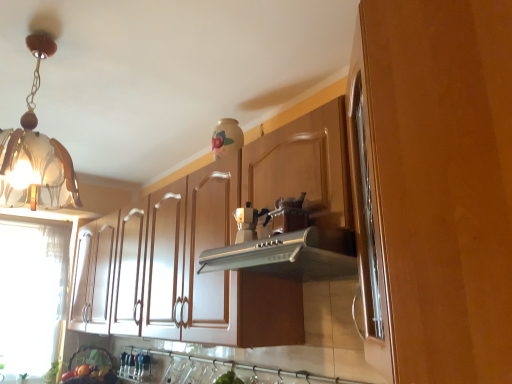
This screenshot has height=384, width=512. Find the location of `wooden cabinet at center, marked as the 1th cabinetry in a front-to-back arrangement`. wooden cabinet at center, marked as the 1th cabinetry in a front-to-back arrangement is located at coordinates (434, 187).

Is matte brown cabinet at center, which appears as the 2th cabinetry when viewed from the front, aimed at wooden cabinet at center, the second cabinetry viewed from the back?

No, matte brown cabinet at center, which appears as the 2th cabinetry when viewed from the front, is not facing towards wooden cabinet at center, the second cabinetry viewed from the back.

From a real-world perspective, does matte brown cabinet at center, which appears as the 2th cabinetry when viewed from the front, stand above wooden cabinet at center, marked as the 1th cabinetry in a front-to-back arrangement?

Correct, in the physical world, matte brown cabinet at center, which appears as the 2th cabinetry when viewed from the front, is higher than wooden cabinet at center, marked as the 1th cabinetry in a front-to-back arrangement.

Which object is positioned more to the left, matte brown cabinet at center, the first cabinetry in the back-to-front sequence, or wooden cabinet at center, the second cabinetry viewed from the back?

Positioned to the left is matte brown cabinet at center, the first cabinetry in the back-to-front sequence.

Considering the sizes of objects matte brown cabinet at center, which appears as the 2th cabinetry when viewed from the front, and wooden cabinet at center, marked as the 1th cabinetry in a front-to-back arrangement, in the image provided, who is thinner, matte brown cabinet at center, which appears as the 2th cabinetry when viewed from the front, or wooden cabinet at center, marked as the 1th cabinetry in a front-to-back arrangement,?

Thinner between the two is matte brown cabinet at center, which appears as the 2th cabinetry when viewed from the front.

Visually, is wooden cabinet at center, the second cabinetry viewed from the back, positioned to the left or to the right of translucent glass pendant light at upper left?

wooden cabinet at center, the second cabinetry viewed from the back, is positioned on translucent glass pendant light at upper left's right side.

How different are the orientations of wooden cabinet at center, the second cabinetry viewed from the back, and translucent glass pendant light at upper left in degrees?

There is a 89.5-degree angle between the facing directions of wooden cabinet at center, the second cabinetry viewed from the back, and translucent glass pendant light at upper left.

In the image, is wooden cabinet at center, the second cabinetry viewed from the back, positioned in front of or behind translucent glass pendant light at upper left?

Clearly, wooden cabinet at center, the second cabinetry viewed from the back, is in front of translucent glass pendant light at upper left.

From the image's perspective, who appears lower, wooden cabinet at center, the second cabinetry viewed from the back, or translucent glass pendant light at upper left?

From the image's view, wooden cabinet at center, the second cabinetry viewed from the back, is below.

Is matte brown cabinet at center, which appears as the 2th cabinetry when viewed from the front, positioned with its back to matte silver coffee machine at center?

Yes, matte brown cabinet at center, which appears as the 2th cabinetry when viewed from the front, is facing away from matte silver coffee machine at center.

From a real-world perspective, is matte brown cabinet at center, the first cabinetry in the back-to-front sequence, positioned under matte silver coffee machine at center based on gravity?

Yes, from a real-world perspective, matte brown cabinet at center, the first cabinetry in the back-to-front sequence, is under matte silver coffee machine at center.

Between matte brown cabinet at center, the first cabinetry in the back-to-front sequence, and matte silver coffee machine at center, which one has less height?

With less height is matte silver coffee machine at center.

Is point (226, 213) more distant than point (261, 210)?

Yes, point (226, 213) is behind point (261, 210).

The image size is (512, 384). In order to click on cabinetry above the silver metallic vent at center (from the image's perspective) in this screenshot , I will do `click(434, 187)`.

Could you tell me if silver metallic vent at center is turned towards wooden cabinet at center, the second cabinetry viewed from the back?

No, silver metallic vent at center is not aimed at wooden cabinet at center, the second cabinetry viewed from the back.

Which is correct: silver metallic vent at center is inside wooden cabinet at center, marked as the 1th cabinetry in a front-to-back arrangement, or outside of it?

silver metallic vent at center lies outside wooden cabinet at center, marked as the 1th cabinetry in a front-to-back arrangement.

Considering the sizes of objects silver metallic vent at center and wooden cabinet at center, the second cabinetry viewed from the back, in the image provided, who is shorter, silver metallic vent at center or wooden cabinet at center, the second cabinetry viewed from the back,?

With less height is silver metallic vent at center.

From the image's perspective, would you say matte silver coffee machine at center is shown under silver metallic vent at center?

No.

Which is behind, point (263, 209) or point (344, 269)?

Point (263, 209)

Which is more to the left, matte silver coffee machine at center or silver metallic vent at center?

From the viewer's perspective, matte silver coffee machine at center appears more on the left side.

From the picture: How distant is matte silver coffee machine at center from silver metallic vent at center?

matte silver coffee machine at center and silver metallic vent at center are 6.20 inches apart.

Is translucent glass pendant light at upper left placed right next to matte brown cabinet at center, the first cabinetry in the back-to-front sequence?

No, translucent glass pendant light at upper left is not making contact with matte brown cabinet at center, the first cabinetry in the back-to-front sequence.

What's the angular difference between translucent glass pendant light at upper left and matte brown cabinet at center, the first cabinetry in the back-to-front sequence,'s facing directions?

The angular difference between translucent glass pendant light at upper left and matte brown cabinet at center, the first cabinetry in the back-to-front sequence, is 89.5 degrees.

Can you confirm if translucent glass pendant light at upper left is taller than matte brown cabinet at center, the first cabinetry in the back-to-front sequence?

No.

From the image's perspective, is translucent glass pendant light at upper left located beneath matte brown cabinet at center, which appears as the 2th cabinetry when viewed from the front?

No.

Between point (395, 281) and point (312, 157), which one is positioned in front?

The point (395, 281) is closer.

In terms of size, does wooden cabinet at center, the second cabinetry viewed from the back, appear bigger or smaller than matte brown cabinet at center, which appears as the 2th cabinetry when viewed from the front?

Considering their sizes, wooden cabinet at center, the second cabinetry viewed from the back, takes up less space than matte brown cabinet at center, which appears as the 2th cabinetry when viewed from the front.

Where is `cabinetry on the left of wooden cabinet at center, the second cabinetry viewed from the back`? This screenshot has height=384, width=512. cabinetry on the left of wooden cabinet at center, the second cabinetry viewed from the back is located at coordinates (228, 243).

Is wooden cabinet at center, marked as the 1th cabinetry in a front-to-back arrangement, in front of matte brown cabinet at center, the first cabinetry in the back-to-front sequence?

Yes, the depth of wooden cabinet at center, marked as the 1th cabinetry in a front-to-back arrangement, is less than that of matte brown cabinet at center, the first cabinetry in the back-to-front sequence.

I want to click on cabinetry that is on the left side of wooden cabinet at center, marked as the 1th cabinetry in a front-to-back arrangement, so coord(228,243).

Locate an element on the screen. cabinetry that is the 2nd object directly below the translucent glass pendant light at upper left (from a real-world perspective) is located at coordinates (434, 187).

Based on their spatial positions, is matte silver coffee machine at center or wooden cabinet at center, marked as the 1th cabinetry in a front-to-back arrangement, closer to translucent glass pendant light at upper left?

matte silver coffee machine at center is positioned closer to the anchor translucent glass pendant light at upper left.

Looking at the image, which one is located closer to matte silver coffee machine at center, translucent glass pendant light at upper left or silver metallic vent at center?

silver metallic vent at center is positioned closer to the anchor matte silver coffee machine at center.

From the image, which object appears to be farther from matte silver coffee machine at center, wooden cabinet at center, marked as the 1th cabinetry in a front-to-back arrangement, or matte brown cabinet at center, the first cabinetry in the back-to-front sequence?

The object further to matte silver coffee machine at center is wooden cabinet at center, marked as the 1th cabinetry in a front-to-back arrangement.

From the image, which object appears to be farther from matte silver coffee machine at center, wooden cabinet at center, marked as the 1th cabinetry in a front-to-back arrangement, or silver metallic vent at center?

Based on the image, wooden cabinet at center, marked as the 1th cabinetry in a front-to-back arrangement, appears to be further to matte silver coffee machine at center.

Estimate the real-world distances between objects in this image. Which object is closer to matte brown cabinet at center, which appears as the 2th cabinetry when viewed from the front, silver metallic vent at center or wooden cabinet at center, the second cabinetry viewed from the back?

silver metallic vent at center.

Which object lies further to the anchor point matte silver coffee machine at center, silver metallic vent at center or translucent glass pendant light at upper left?

Based on the image, translucent glass pendant light at upper left appears to be further to matte silver coffee machine at center.

Looking at the image, which one is located closer to matte silver coffee machine at center, matte brown cabinet at center, the first cabinetry in the back-to-front sequence, or silver metallic vent at center?

silver metallic vent at center is closer to matte silver coffee machine at center.

Based on their spatial positions, is matte silver coffee machine at center or matte brown cabinet at center, which appears as the 2th cabinetry when viewed from the front, further from translucent glass pendant light at upper left?

The object further to translucent glass pendant light at upper left is matte silver coffee machine at center.

Locate an element on the screen. This screenshot has height=384, width=512. vent located between translucent glass pendant light at upper left and wooden cabinet at center, marked as the 1th cabinetry in a front-to-back arrangement, in the left-right direction is located at coordinates (290, 255).

Identify the location of cabinetry between translucent glass pendant light at upper left and silver metallic vent at center in the horizontal direction. This screenshot has width=512, height=384. (228, 243).

What are the coordinates of `cabinetry located between translucent glass pendant light at upper left and wooden cabinet at center, marked as the 1th cabinetry in a front-to-back arrangement, in the left-right direction` in the screenshot? It's located at (228, 243).

The width and height of the screenshot is (512, 384). I want to click on vent between matte brown cabinet at center, which appears as the 2th cabinetry when viewed from the front, and wooden cabinet at center, the second cabinetry viewed from the back, from left to right, so click(x=290, y=255).